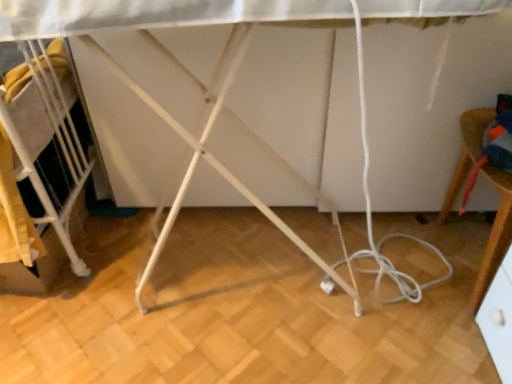
What do you see at coordinates (494, 235) in the screenshot?
I see `wooden chair at right` at bounding box center [494, 235].

Image resolution: width=512 pixels, height=384 pixels. Identify the location of wooden chair at right. (494, 235).

Identify the location of wooden chair at right. (494, 235).